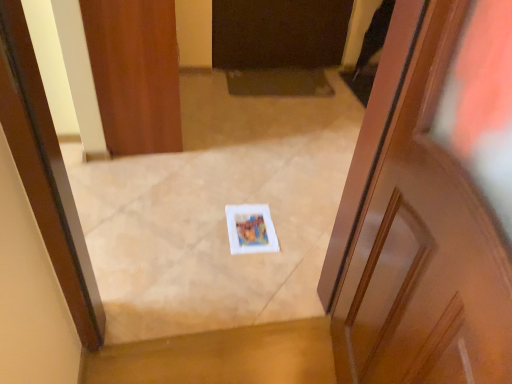
Question: Is wooden door at center, the first door positioned from the bottom, bigger than wooden door at upper left, the second door from the front?

Choices:
 (A) no
 (B) yes

Answer: (A)

Question: Does wooden door at center, which is the 1th door from right to left, have a lesser width compared to wooden door at upper left, arranged as the 2th door when viewed from the right?

Choices:
 (A) yes
 (B) no

Answer: (A)

Question: Does wooden door at center, the second door from the left, have a smaller size compared to wooden door at upper left, marked as the 2th door in a bottom-to-top arrangement?

Choices:
 (A) yes
 (B) no

Answer: (A)

Question: From a real-world perspective, is wooden door at center, the second door from the left, over wooden door at upper left, arranged as the 2th door when viewed from the right?

Choices:
 (A) yes
 (B) no

Answer: (A)

Question: Is the depth of wooden door at center, the second door from the back, less than that of wooden door at upper left, the second door from the front?

Choices:
 (A) no
 (B) yes

Answer: (B)

Question: Is wooden door at center, the second door from the left, placed right next to wooden door at upper left, which appears as the 1th door when viewed from the top?

Choices:
 (A) no
 (B) yes

Answer: (A)

Question: Can you confirm if wooden door at upper left, arranged as the 2th door when viewed from the right, is taller than wooden door at center, the second door from the back?

Choices:
 (A) no
 (B) yes

Answer: (A)

Question: Does wooden door at upper left, which appears as the 1th door when viewed from the top, appear on the right side of wooden door at center, the second door from the back?

Choices:
 (A) no
 (B) yes

Answer: (A)

Question: From a real-world perspective, is wooden door at upper left, which appears as the 1th door when viewed from the top, located higher than wooden door at center, which is the 1th door from right to left?

Choices:
 (A) yes
 (B) no

Answer: (B)

Question: Is wooden door at upper left, the second door from the front, positioned with its back to wooden door at center, the second door from the back?

Choices:
 (A) yes
 (B) no

Answer: (B)

Question: From a real-world perspective, is wooden door at upper left, arranged as the 2th door when viewed from the right, under wooden door at center, the 2th door viewed from the top?

Choices:
 (A) no
 (B) yes

Answer: (B)

Question: In the image, is wooden door at upper left, the second door from the front, positioned in front of or behind wooden door at center, the second door from the left?

Choices:
 (A) behind
 (B) front

Answer: (A)